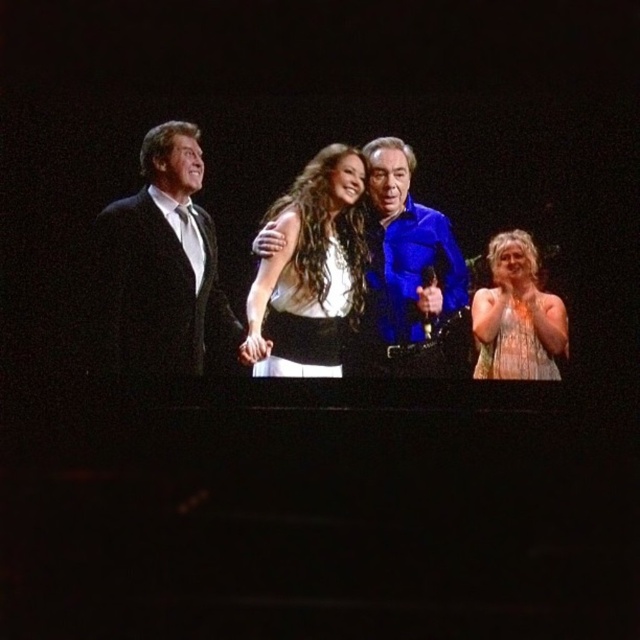
From the picture: Who is higher up, black satin suit at left or white satin dress at center?

black satin suit at left

Is black satin suit at left taller than white satin dress at center?

Indeed, black satin suit at left has a greater height compared to white satin dress at center.

Where is `black satin suit at left`? The height and width of the screenshot is (640, 640). black satin suit at left is located at coordinates (161, 269).

Who is taller, black satin suit at left or black satin dress at center?

With more height is black satin suit at left.

In the scene shown: Which is above, black satin suit at left or black satin dress at center?

Positioned higher is black satin suit at left.

Where is `black satin suit at left`? The width and height of the screenshot is (640, 640). black satin suit at left is located at coordinates (161, 269).

Consider the image. Measure the distance between point (140,323) and camera.

They are 10.22 meters apart.

Does point (134, 346) come farther from viewer compared to point (484, 308)?

Yes, point (134, 346) is farther from viewer.

Find the location of `black satin suit at left`. black satin suit at left is located at coordinates (161, 269).